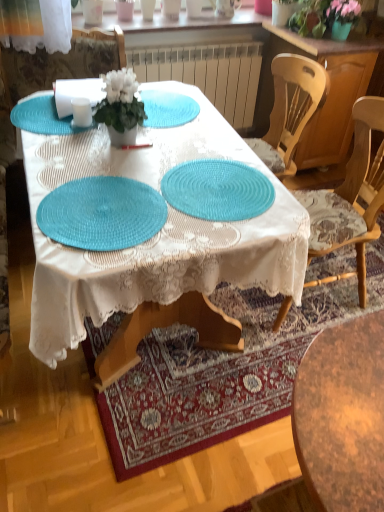
Identify the location of free space above teal woven placemat at center, the 1th glass plate ordered from the bottom (from a real-world perspective). click(x=100, y=206).